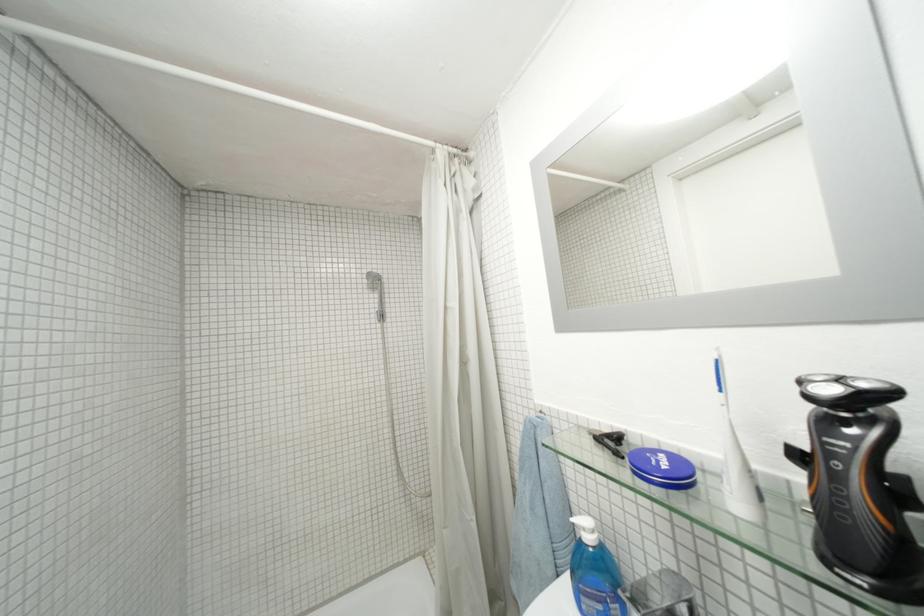
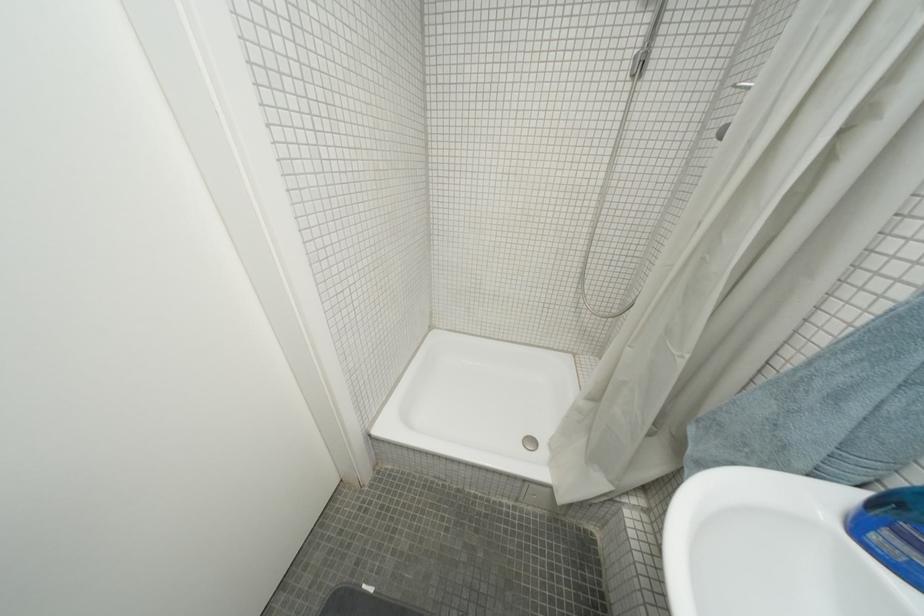
How did the camera likely rotate?

The camera rotated toward left-down.